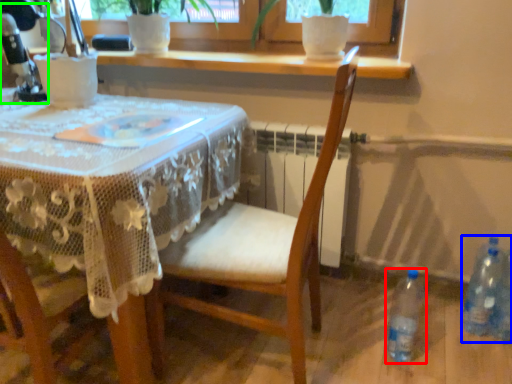
Question: Considering the real-world distances, which object is closest to bottle (highlighted by a red box)? bottle (highlighted by a blue box) or sewing machine (highlighted by a green box).

Choices:
 (A) bottle
 (B) sewing machine

Answer: (A)